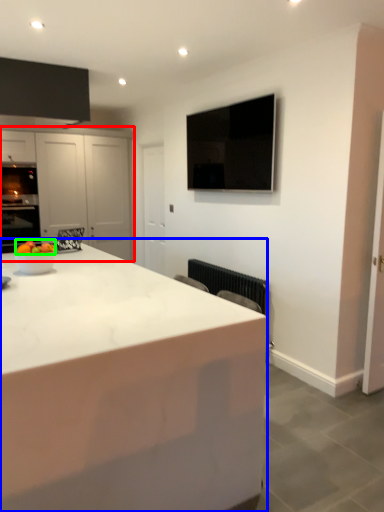
Question: Which object is positioned closest to cabinetry (highlighted by a red box)? Select from countertop (highlighted by a blue box) and fruit (highlighted by a green box).

Choices:
 (A) countertop
 (B) fruit

Answer: (B)